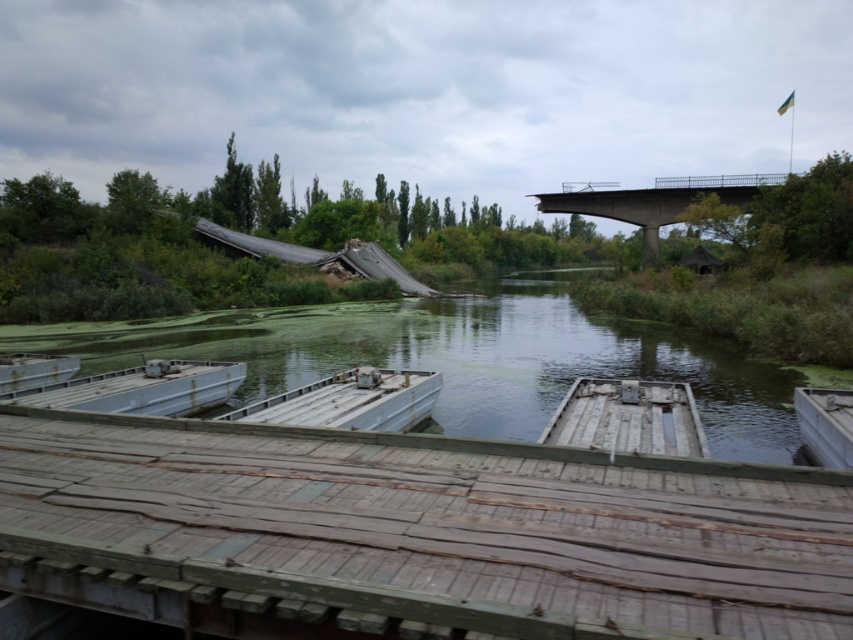
Who is higher up, white matte boat at center or metallic gray boat at center?

metallic gray boat at center

Locate an element on the screen. white matte boat at center is located at coordinates (350, 401).

Which of these two, green algae water at center or white matte boat at center, stands taller?

green algae water at center is taller.

Who is positioned more to the right, green algae water at center or white matte boat at center?

From the viewer's perspective, white matte boat at center appears more on the right side.

In the scene shown: Who is more distant from viewer, (299,381) or (236,410)?

Point (299,381)

You are a GUI agent. You are given a task and a screenshot of the screen. Output one action in this format:
    pyautogui.click(x=<x>, y=<y>)
    Task: Click on the green algae water at center
    The image size is (853, 640).
    Given the screenshot: What is the action you would take?
    pyautogui.click(x=461, y=356)

Is point (692, 433) positioned in front of point (347, 378)?

Yes, it is.

At what (x,y) coordinates should I click in order to perform the action: click on rusty metal boat at center. Please return your answer as a coordinate pair (x, y). Looking at the image, I should click on tap(628, 417).